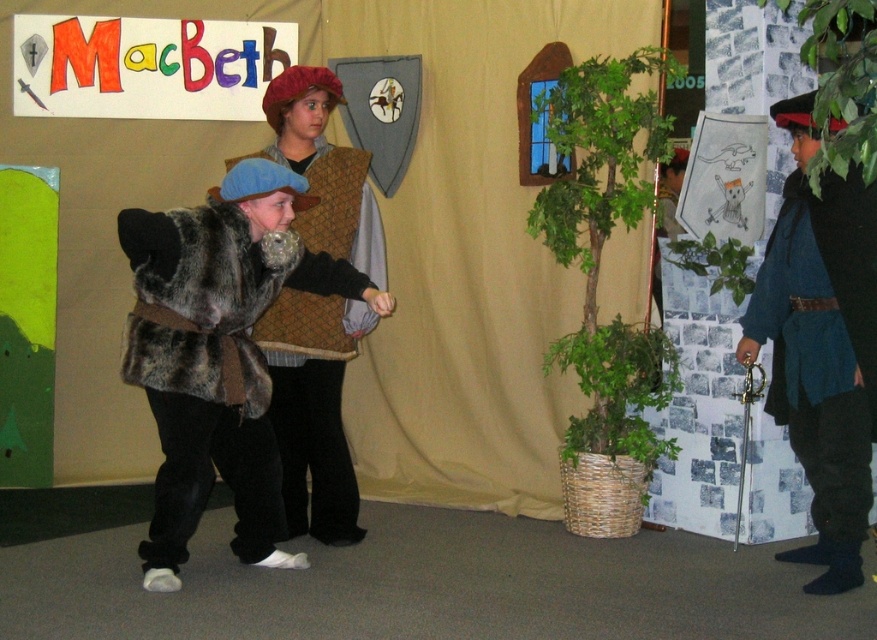
Question: Which is farther from the fuzzy brown fur vest at center?

Choices:
 (A) fur vest at center
 (B) blue woolen tunic at right

Answer: (B)

Question: Is the position of fur vest at center more distant than that of fuzzy brown fur vest at center?

Choices:
 (A) no
 (B) yes

Answer: (B)

Question: Which point is farther to the camera?

Choices:
 (A) fur vest at center
 (B) fuzzy brown fur vest at center

Answer: (A)

Question: Which of these objects is positioned farthest from the blue woolen tunic at right?

Choices:
 (A) fuzzy brown fur vest at center
 (B) fur vest at center

Answer: (A)

Question: Where is blue woolen tunic at right located in relation to fur vest at center in the image?

Choices:
 (A) left
 (B) right

Answer: (B)

Question: Does blue woolen tunic at right appear on the left side of fur vest at center?

Choices:
 (A) no
 (B) yes

Answer: (A)